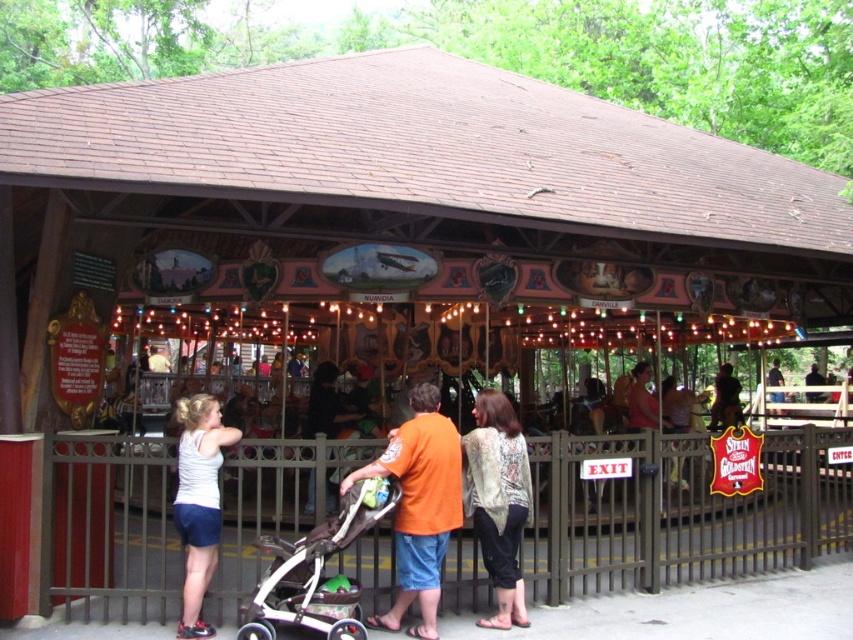
In the scene shown: You are a photographer at the fairground and want to capture both the orange cotton shirt at center and the white matte tank top at center in a single photo. Based on their positions, which one should you focus on first to ensure both are in frame?

The orange cotton shirt at center is located above the white matte tank top at center, so you should focus on the orange cotton shirt at center first to ensure both are in frame.

You are standing at the fairground and want to reach the carousel. You see two points marked on the ground ahead of you. Which point is closer to the carousel entrance? The points are labeled as point (428, 413) and point (207, 445).

Point (207, 445) is closer to the carousel entrance because it is less further to the viewer than point (428, 413).

You are a photographer trying to capture a clear shot of both the orange cotton shirt at center and the white matte tank top at center. Since you want to ensure both are visible in the frame, which clothing item should you focus on first to account for their size difference?

The orange cotton shirt at center is larger than the white matte tank top at center, so you should focus on the orange cotton shirt at center first to ensure it fits within the frame before adjusting for the smaller one.